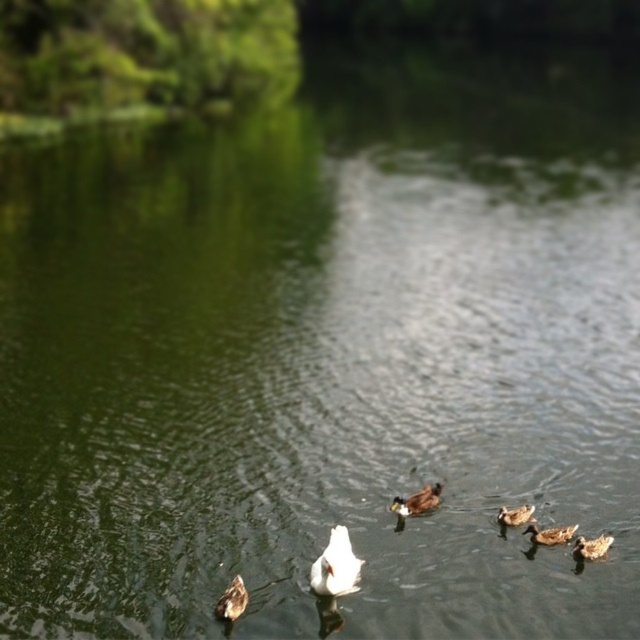
Is brown matte duck at lower left below brown matte duck at lower right?

Indeed, brown matte duck at lower left is positioned under brown matte duck at lower right.

Is brown matte duck at lower left thinner than brown matte duck at lower right?

Yes.

Does point (221, 602) come behind point (538, 538)?

That is False.

Identify the location of brown matte duck at lower left. This screenshot has height=640, width=640. (232, 600).

Can you confirm if brown matte duck at center is taller than brown fuzzy duckling at lower right?

Yes, brown matte duck at center is taller than brown fuzzy duckling at lower right.

Is point (403, 509) behind point (593, 557)?

Yes, it is.

The image size is (640, 640). Find the location of `brown matte duck at center`. brown matte duck at center is located at coordinates (417, 500).

Which is behind, point (336, 564) or point (435, 502)?

Point (435, 502)

Can you confirm if white feathered duck at center is bigger than brown matte duck at center?

Correct, white feathered duck at center is larger in size than brown matte duck at center.

Between point (332, 536) and point (429, 499), which one is positioned behind?

The point (429, 499) is behind.

This screenshot has width=640, height=640. I want to click on white feathered duck at center, so click(336, 564).